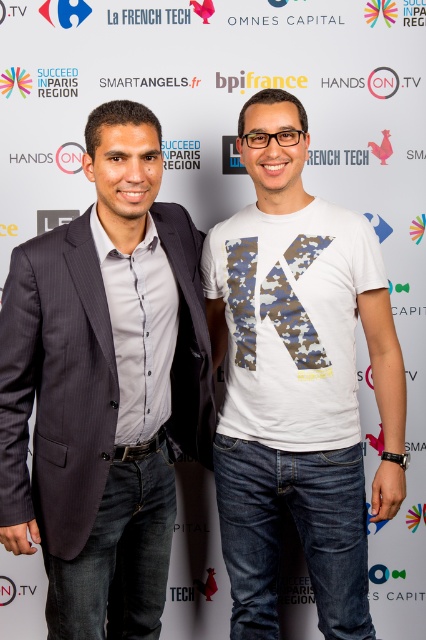
Question: Which of the following is the farthest from the observer?

Choices:
 (A) (89, 376)
 (B) (271, 308)
 (C) (328, 204)

Answer: (C)

Question: Which point is farther to the camera?

Choices:
 (A) white matte t-shirt at center
 (B) camo fabric t-shirt at center
 (C) dark gray pinstripe suit at left

Answer: (B)

Question: Based on their relative distances, which object is farther from the camo fabric t-shirt at center?

Choices:
 (A) dark gray pinstripe suit at left
 (B) white matte t-shirt at center

Answer: (A)

Question: Where is dark gray pinstripe suit at left located in relation to camo fabric t-shirt at center in the image?

Choices:
 (A) above
 (B) below

Answer: (B)

Question: Is dark gray pinstripe suit at left above camo fabric t-shirt at center?

Choices:
 (A) no
 (B) yes

Answer: (A)

Question: Can you confirm if dark gray pinstripe suit at left is thinner than white matte t-shirt at center?

Choices:
 (A) yes
 (B) no

Answer: (A)